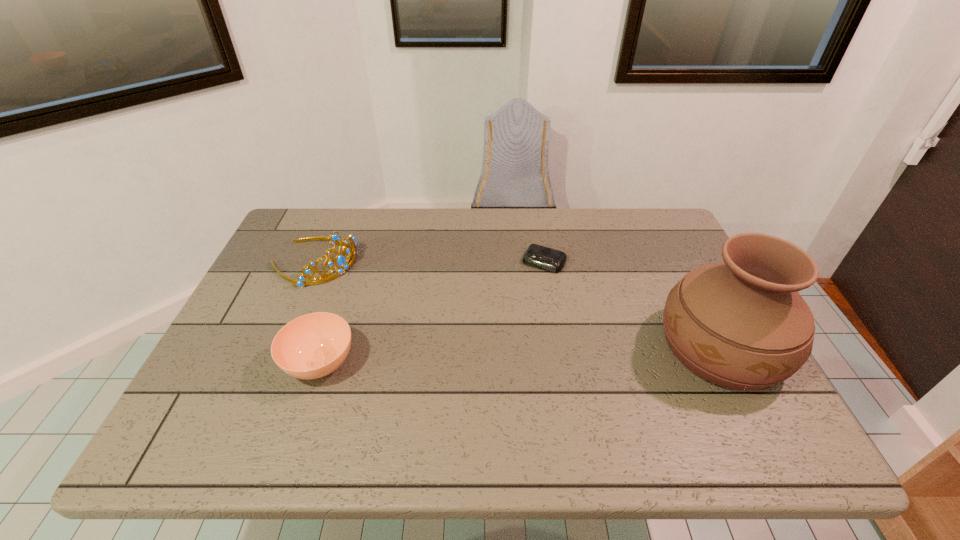
Identify the location of object that is the second closest to the third shortest object. This screenshot has height=540, width=960. (538, 256).

Image resolution: width=960 pixels, height=540 pixels. I want to click on vacant space that satisfies the following two spatial constraints: 1. on the front side of the third tallest object; 2. on the left side of the third shortest object, so click(270, 363).

This screenshot has height=540, width=960. Identify the location of free space that satisfies the following two spatial constraints: 1. on the back side of the soup bowl; 2. on the left side of the shortest object. 353,262.